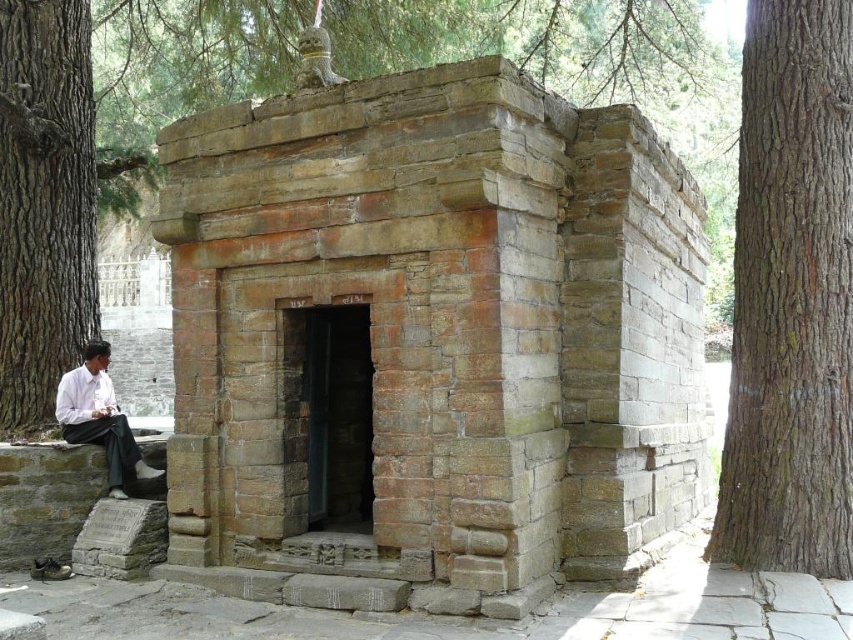
Can you confirm if rustic stone hut at center is positioned above white shirt at lower left?

Indeed, rustic stone hut at center is positioned over white shirt at lower left.

The width and height of the screenshot is (853, 640). What do you see at coordinates (430, 342) in the screenshot?
I see `rustic stone hut at center` at bounding box center [430, 342].

Locate an element on the screen. The height and width of the screenshot is (640, 853). rustic stone hut at center is located at coordinates (430, 342).

Locate an element on the screen. The image size is (853, 640). rustic stone hut at center is located at coordinates (430, 342).

Which is behind, point (258, 307) or point (775, 28)?

The point (258, 307) is behind.

The image size is (853, 640). Find the location of `rustic stone hut at center`. rustic stone hut at center is located at coordinates (430, 342).

Does brown rough bark tree at right have a smaller size compared to white shirt at lower left?

No, brown rough bark tree at right is not smaller than white shirt at lower left.

Is brown rough bark tree at right to the left of white shirt at lower left from the viewer's perspective?

In fact, brown rough bark tree at right is to the right of white shirt at lower left.

Between point (843, 522) and point (107, 349), which one is positioned in front?

Positioned in front is point (843, 522).

Where is `brown rough bark tree at right`? brown rough bark tree at right is located at coordinates tap(791, 298).